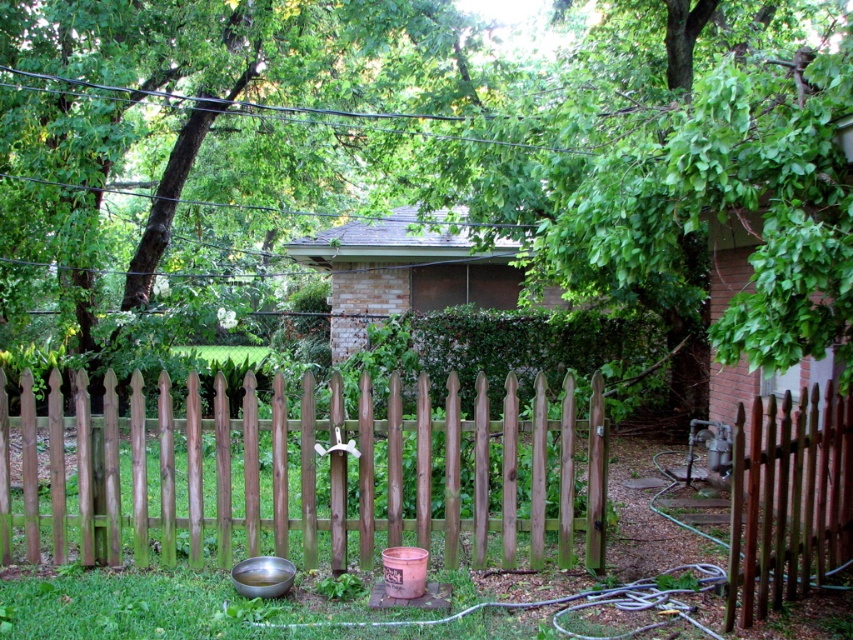
Question: Based on their relative distances, which object is farther from the green leafy tree at upper center?

Choices:
 (A) brown wooden fence at right
 (B) brown wooden fence at center

Answer: (A)

Question: Is brown wooden fence at center thinner than brown wooden fence at right?

Choices:
 (A) no
 (B) yes

Answer: (A)

Question: Does brown wooden fence at center come in front of brown wooden fence at right?

Choices:
 (A) no
 (B) yes

Answer: (A)

Question: Which of the following is the farthest from the observer?

Choices:
 (A) brown wooden fence at center
 (B) brown wooden fence at right
 (C) green leafy tree at upper center

Answer: (C)

Question: Does green leafy tree at upper center appear over brown wooden fence at right?

Choices:
 (A) no
 (B) yes

Answer: (B)

Question: Among these points, which one is farthest from the camera?

Choices:
 (A) (740, 627)
 (B) (593, 570)

Answer: (B)